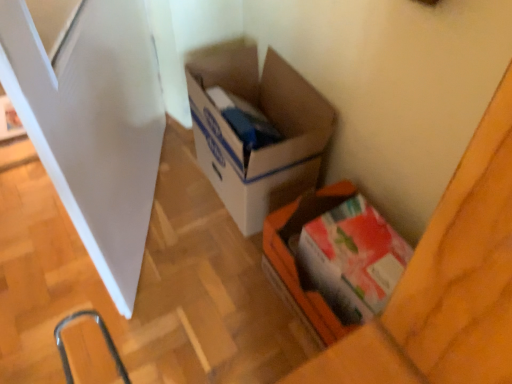
Question: Considering the positions of point (307, 124) and point (344, 281), is point (307, 124) closer or farther from the camera than point (344, 281)?

Choices:
 (A) closer
 (B) farther

Answer: (B)

Question: Do you think cardboard box at center, which is counted as the 1th box, starting from the back, is within matte cardboard box at lower right, which appears as the first box when viewed from the front, or outside of it?

Choices:
 (A) outside
 (B) inside

Answer: (A)

Question: Estimate the real-world distances between objects in this image. Which object is closer to the cardboard box at center, which is counted as the second box, starting from the front?

Choices:
 (A) matte cardboard box at lower right, which appears as the first box when viewed from the front
 (B) white glossy screen door at left

Answer: (A)

Question: Estimate the real-world distances between objects in this image. Which object is farther from the white glossy screen door at left?

Choices:
 (A) cardboard box at center, which is counted as the second box, starting from the front
 (B) matte cardboard box at lower right, which appears as the first box when viewed from the front

Answer: (B)